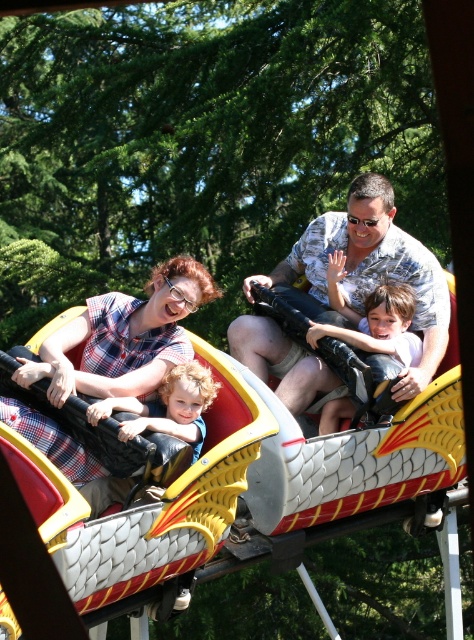
You are a photographer trying to capture the family on the dragon roller coaster. You notice a point at coordinates (x=366, y=275) in the image. What object is located at that point?

The point at coordinates (x=366, y=275) indicates the matte gray shirt at center.

You are standing at the entrance of the roller coaster and see two points marked in the image. The first point is at coordinates point [6,420] and the second point is at point [338,296]. Which point is closer to you?

Point [6,420] is in front of point [338,296], so the first point is closer to you.

In the scene shown: You are a photographer trying to capture a clear photo of the smooth plastic toy at center without the plaid fabric at center blocking it. Based on the scene, can you adjust your position to achieve this?

The plaid fabric at center is in front of the smooth plastic toy at center, so moving your camera position slightly behind the plaid fabric at center would allow you to see the smooth plastic toy at center without obstruction.